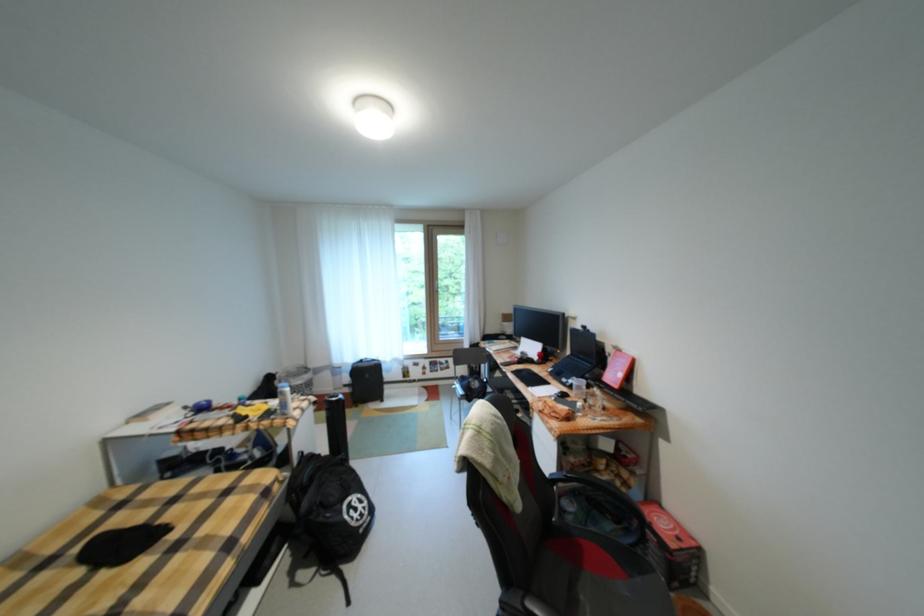
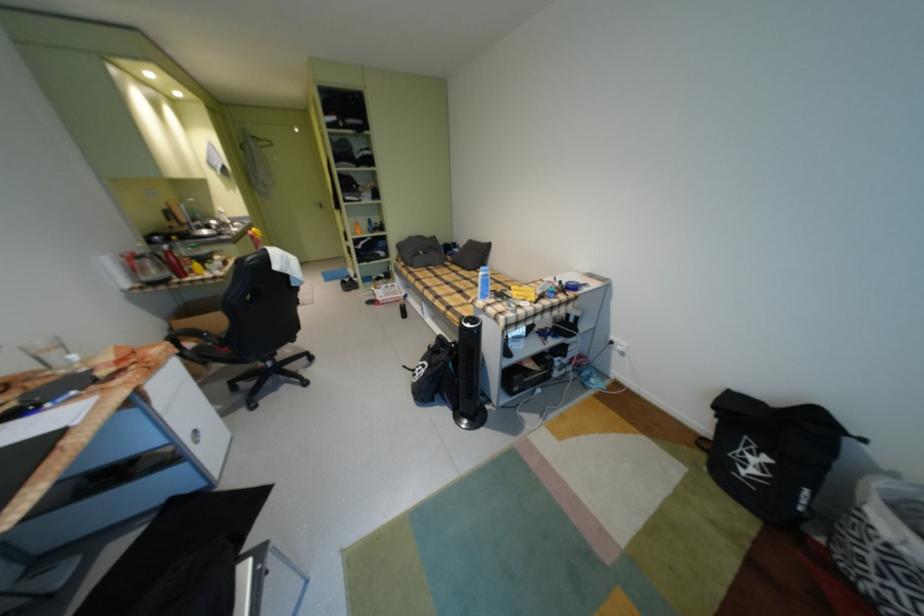
Locate, in the second image, the point that corresponds to (273,501) in the first image.

(470, 318)